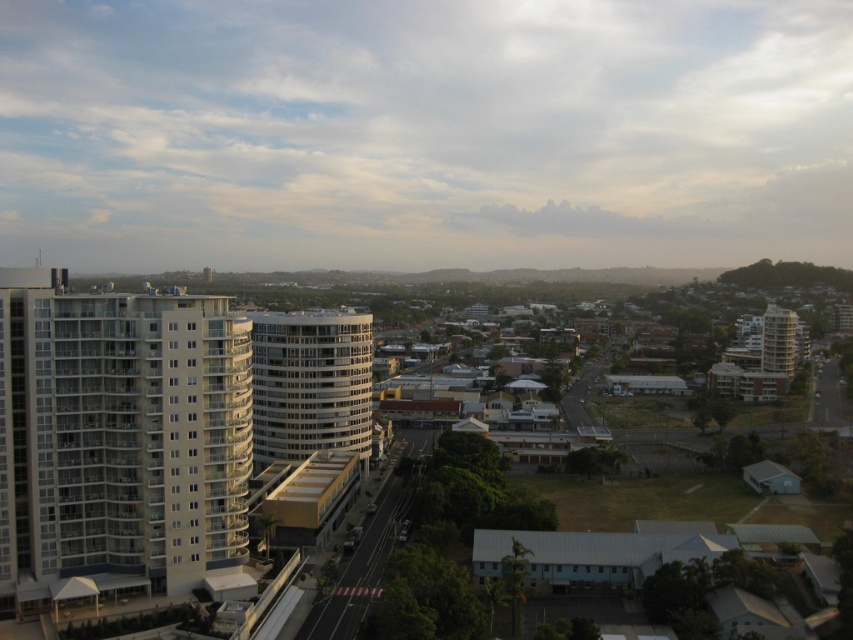
Question: Among these points, which one is nearest to the camera?

Choices:
 (A) (90, 424)
 (B) (250, 312)

Answer: (A)

Question: From the image, what is the correct spatial relationship of white glossy building at left in relation to white glassy building at center?

Choices:
 (A) right
 (B) left

Answer: (B)

Question: Which point appears closest to the camera in this image?

Choices:
 (A) (206, 336)
 (B) (283, 362)

Answer: (A)

Question: Which point is farther to the camera?

Choices:
 (A) (103, 339)
 (B) (300, 422)

Answer: (B)

Question: Is white glossy building at left smaller than white glassy building at center?

Choices:
 (A) no
 (B) yes

Answer: (B)

Question: From the image, what is the correct spatial relationship of white glossy building at left in relation to white glassy building at center?

Choices:
 (A) above
 (B) below

Answer: (B)